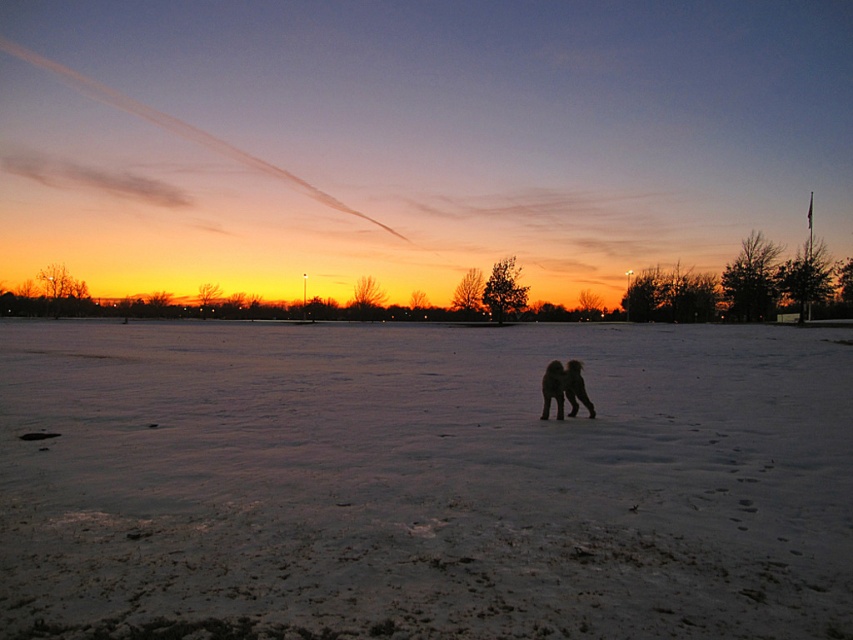
Question: Can you confirm if white powdery snow at center is bigger than black fur dog at center?

Choices:
 (A) yes
 (B) no

Answer: (A)

Question: Is white powdery snow at center to the right of black fur dog at center from the viewer's perspective?

Choices:
 (A) no
 (B) yes

Answer: (A)

Question: Which of the following is the farthest from the observer?

Choices:
 (A) black fur dog at center
 (B) white powdery snow at center

Answer: (A)

Question: Does white powdery snow at center have a greater width compared to black fur dog at center?

Choices:
 (A) yes
 (B) no

Answer: (A)

Question: Which point appears closest to the camera in this image?

Choices:
 (A) (312, 422)
 (B) (561, 387)

Answer: (A)

Question: Which object appears farthest from the camera in this image?

Choices:
 (A) black fur dog at center
 (B) white powdery snow at center

Answer: (A)